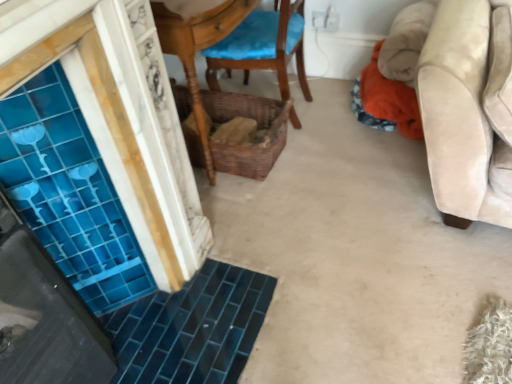
Question: From a real-world perspective, is woven brown basket at center under wooden chair with blue cushion at center?

Choices:
 (A) no
 (B) yes

Answer: (B)

Question: Is woven brown basket at center to the left of wooden chair with blue cushion at center from the viewer's perspective?

Choices:
 (A) no
 (B) yes

Answer: (B)

Question: Is woven brown basket at center at the right side of wooden chair with blue cushion at center?

Choices:
 (A) no
 (B) yes

Answer: (A)

Question: Does woven brown basket at center have a greater width compared to wooden chair with blue cushion at center?

Choices:
 (A) yes
 (B) no

Answer: (A)

Question: From the image's perspective, is woven brown basket at center over wooden chair with blue cushion at center?

Choices:
 (A) no
 (B) yes

Answer: (A)

Question: Considering the relative sizes of woven brown basket at center and wooden chair with blue cushion at center in the image provided, is woven brown basket at center smaller than wooden chair with blue cushion at center?

Choices:
 (A) yes
 (B) no

Answer: (A)

Question: From the image's perspective, is wooden chair with blue cushion at center above woven brown basket at center?

Choices:
 (A) no
 (B) yes

Answer: (B)

Question: Is wooden chair with blue cushion at center positioned beyond the bounds of woven brown basket at center?

Choices:
 (A) no
 (B) yes

Answer: (B)

Question: Is wooden chair with blue cushion at center not near woven brown basket at center?

Choices:
 (A) yes
 (B) no

Answer: (B)

Question: Is wooden chair with blue cushion at center looking in the opposite direction of woven brown basket at center?

Choices:
 (A) yes
 (B) no

Answer: (B)

Question: Can you confirm if wooden chair with blue cushion at center is taller than woven brown basket at center?

Choices:
 (A) no
 (B) yes

Answer: (B)

Question: From a real-world perspective, is wooden chair with blue cushion at center below woven brown basket at center?

Choices:
 (A) yes
 (B) no

Answer: (B)

Question: From the image's perspective, is woven brown basket at center located above or below wooden chair with blue cushion at center?

Choices:
 (A) above
 (B) below

Answer: (B)